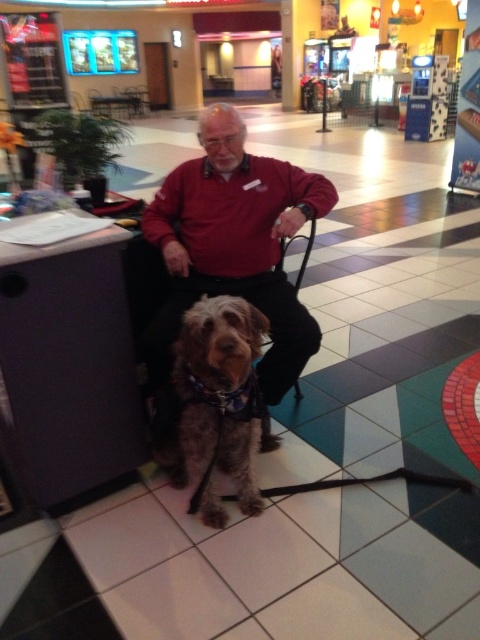
Question: Observing the image, what is the correct spatial positioning of matte red shirt at center in reference to fuzzy brown dog at center?

Choices:
 (A) below
 (B) above

Answer: (B)

Question: Which point is closer to the camera?

Choices:
 (A) matte red shirt at center
 (B) fuzzy brown dog at center

Answer: (B)

Question: Considering the relative positions of matte red shirt at center and fuzzy brown dog at center in the image provided, where is matte red shirt at center located with respect to fuzzy brown dog at center?

Choices:
 (A) left
 (B) right

Answer: (B)

Question: Does matte red shirt at center appear under fuzzy brown dog at center?

Choices:
 (A) yes
 (B) no

Answer: (B)

Question: Which of the following is the farthest from the observer?

Choices:
 (A) (214, 268)
 (B) (189, 371)

Answer: (A)

Question: Which point is farther from the camera taking this photo?

Choices:
 (A) (191, 166)
 (B) (202, 513)

Answer: (A)